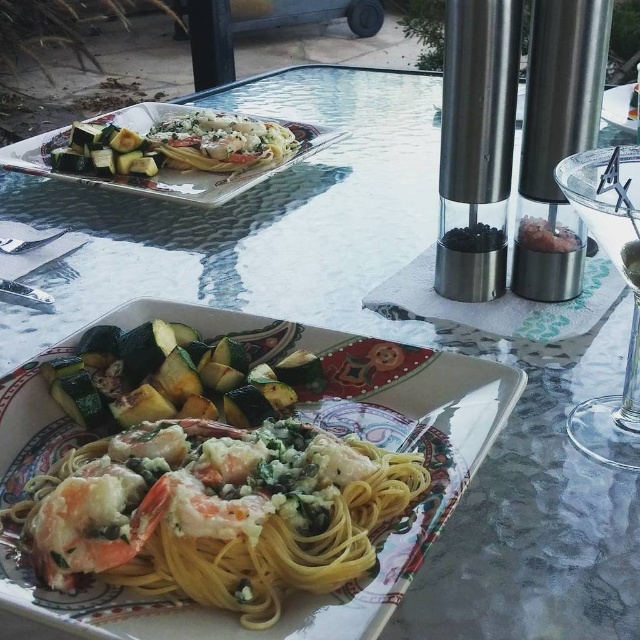
You are a photographer standing at the center of the dining area. You want to take a photo of the green matte zucchini at lower left. According to the coordinates provided, where should you position your camera to capture the zucchini in the frame?

The green matte zucchini at lower left is located at coordinates point (172, 378), so you should position your camera to aim towards that coordinate to capture it in the frame.

You are standing at the center of the glass table and want to place a napkin on the matte glass platter at upper left. Which direction should you move to reach it?

The matte glass platter at upper left is located at point (x=168, y=170), so you should move towards the upper left direction to reach it.

You are a food critic evaluating the presentation of the dishes on the table. Which dish has a lower height between the green matte zucchini at lower left and the white creamy pasta at upper center?

The green matte zucchini at lower left has a lesser height compared to the white creamy pasta at upper center, so the green matte zucchini at lower left is the dish with the lower height.